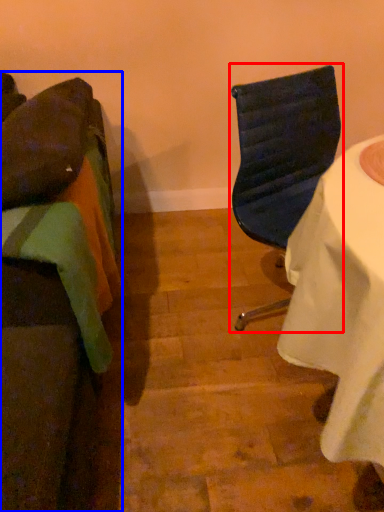
Question: Among these objects, which one is farthest to the camera, chair (highlighted by a red box) or chair (highlighted by a blue box)?

Choices:
 (A) chair
 (B) chair

Answer: (A)